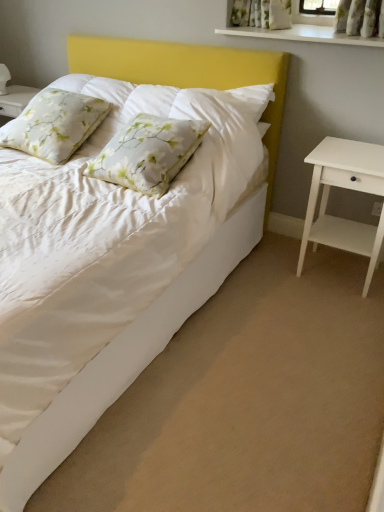
The image size is (384, 512). Describe the element at coordinates (345, 188) in the screenshot. I see `white matte nightstand at right` at that location.

You are a GUI agent. You are given a task and a screenshot of the screen. Output one action in this format:
    pyautogui.click(x=<x>, y=<y>)
    Task: Click on the white matte nightstand at right
    The height and width of the screenshot is (512, 384).
    Given the screenshot: What is the action you would take?
    pyautogui.click(x=345, y=188)

Does white satin bed at lower left have a lesser width compared to floral fabric pillow at upper left, placed as the 2th pillow when sorted from right to left?

Incorrect, the width of white satin bed at lower left is not less than that of floral fabric pillow at upper left, placed as the 2th pillow when sorted from right to left.

Between white satin bed at lower left and floral fabric pillow at upper left, placed as the 2th pillow when sorted from right to left, which one has larger size?

With larger size is white satin bed at lower left.

Between point (234, 254) and point (25, 117), which one is positioned behind?

Positioned behind is point (234, 254).

Considering the relative sizes of white satin bed at lower left and floral fabric pillow at upper left, placed as the 2th pillow when sorted from right to left, in the image provided, is white satin bed at lower left taller than floral fabric pillow at upper left, placed as the 2th pillow when sorted from right to left,?

No, white satin bed at lower left is not taller than floral fabric pillow at upper left, placed as the 2th pillow when sorted from right to left.

In the scene shown: Considering the sizes of objects floral fabric pillow at upper left, placed as the 2th pillow when sorted from right to left, and white glossy shelf at upper center in the image provided, who is bigger, floral fabric pillow at upper left, placed as the 2th pillow when sorted from right to left, or white glossy shelf at upper center?

floral fabric pillow at upper left, placed as the 2th pillow when sorted from right to left, is bigger.

Considering the sizes of objects floral fabric pillow at upper left, placed as the 2th pillow when sorted from right to left, and white glossy shelf at upper center in the image provided, who is thinner, floral fabric pillow at upper left, placed as the 2th pillow when sorted from right to left, or white glossy shelf at upper center?

white glossy shelf at upper center.

In the scene shown: Is floral fabric pillow at upper left, the 1th pillow in the left-to-right sequence, situated inside white glossy shelf at upper center or outside?

Result: The correct answer is: outside.

Is floral fabric pillow at upper left, placed as the 2th pillow when sorted from right to left, facing towards white glossy shelf at upper center?

No, floral fabric pillow at upper left, placed as the 2th pillow when sorted from right to left, is not oriented towards white glossy shelf at upper center.

Does white glossy shelf at upper center have a lesser width compared to floral fabric pillow at upper left, placed as the 2th pillow when sorted from right to left?

Correct, the width of white glossy shelf at upper center is less than that of floral fabric pillow at upper left, placed as the 2th pillow when sorted from right to left.

Does white glossy shelf at upper center have a larger size compared to floral fabric pillow at upper left, placed as the 2th pillow when sorted from right to left?

Actually, white glossy shelf at upper center might be smaller than floral fabric pillow at upper left, placed as the 2th pillow when sorted from right to left.

Is white glossy shelf at upper center completely or partially outside of floral fabric pillow at upper left, the 1th pillow in the left-to-right sequence?

Indeed, white glossy shelf at upper center is completely outside floral fabric pillow at upper left, the 1th pillow in the left-to-right sequence.

How different are the orientations of white glossy shelf at upper center and floral fabric pillow at upper left, the 1th pillow in the left-to-right sequence, in degrees?

The angular difference between white glossy shelf at upper center and floral fabric pillow at upper left, the 1th pillow in the left-to-right sequence, is 3.9 degrees.

Where is `nightstand below the white glossy shelf at upper center (from the image's perspective)`? nightstand below the white glossy shelf at upper center (from the image's perspective) is located at coordinates (345, 188).

From the image's perspective, is white glossy shelf at upper center on white matte nightstand at right?

Indeed, from the image's perspective, white glossy shelf at upper center is shown above white matte nightstand at right.

Which of these two, white glossy shelf at upper center or white matte nightstand at right, stands taller?

Standing taller between the two is white matte nightstand at right.

Considering their positions, is white glossy shelf at upper center located in front of or behind white matte nightstand at right?

white glossy shelf at upper center is behind white matte nightstand at right.

From a real-world perspective, is floral fabric pillow at upper left, placed as the 2th pillow when sorted from right to left, below white floral pillow at center, positioned as the second pillow in left-to-right order?

No, from a real-world perspective, floral fabric pillow at upper left, placed as the 2th pillow when sorted from right to left, is not under white floral pillow at center, positioned as the second pillow in left-to-right order.

Is floral fabric pillow at upper left, the 1th pillow in the left-to-right sequence, bigger than white floral pillow at center, positioned as the second pillow in left-to-right order?

Yes.

Where is `pillow below the floral fabric pillow at upper left, placed as the 2th pillow when sorted from right to left (from the image's perspective)`? The image size is (384, 512). pillow below the floral fabric pillow at upper left, placed as the 2th pillow when sorted from right to left (from the image's perspective) is located at coordinates (148, 153).

Is floral fabric pillow at upper left, the 1th pillow in the left-to-right sequence, taller or shorter than white floral pillow at center, placed as the 1th pillow when sorted from right to left?

floral fabric pillow at upper left, the 1th pillow in the left-to-right sequence, is taller than white floral pillow at center, placed as the 1th pillow when sorted from right to left.

Considering the sizes of objects white matte nightstand at right and white satin bed at lower left in the image provided, who is thinner, white matte nightstand at right or white satin bed at lower left?

white matte nightstand at right is thinner.

Which point is more forward, [369,170] or [105,45]?

The point [369,170] is closer.

Considering the sizes of objects white matte nightstand at right and white satin bed at lower left in the image provided, who is smaller, white matte nightstand at right or white satin bed at lower left?

white matte nightstand at right.

Where is `nightstand behind the white satin bed at lower left`? nightstand behind the white satin bed at lower left is located at coordinates (345, 188).

Locate an element on the screen. Image resolution: width=384 pixels, height=512 pixels. nightstand below the white floral pillow at center, positioned as the second pillow in left-to-right order (from the image's perspective) is located at coordinates (345, 188).

From a real-world perspective, is white floral pillow at center, positioned as the second pillow in left-to-right order, physically below white matte nightstand at right?

Incorrect, from a real-world perspective, white floral pillow at center, positioned as the second pillow in left-to-right order, is higher than white matte nightstand at right.

In the scene shown: Which is more distant, (204,131) or (338,160)?

The point (204,131) is behind.

Is white floral pillow at center, placed as the 1th pillow when sorted from right to left, at the left side of white matte nightstand at right?

Indeed, white floral pillow at center, placed as the 1th pillow when sorted from right to left, is positioned on the left side of white matte nightstand at right.

Find the location of `bed located underneath the floral fabric pillow at upper left, the 1th pillow in the left-to-right sequence (from a real-world perspective)`. bed located underneath the floral fabric pillow at upper left, the 1th pillow in the left-to-right sequence (from a real-world perspective) is located at coordinates (180, 274).

From the white glossy shelf at upper center, count the 2nd pillow to the left and point to it. Please provide its 2D coordinates.

[(55, 124)]

Based on their spatial positions, is white matte nightstand at right or white glossy shelf at upper center further from floral fabric pillow at upper left, placed as the 2th pillow when sorted from right to left?

The object further to floral fabric pillow at upper left, placed as the 2th pillow when sorted from right to left, is white matte nightstand at right.

Considering their positions, is white satin bed at lower left positioned closer to white glossy shelf at upper center than white floral pillow at center, placed as the 1th pillow when sorted from right to left?

white floral pillow at center, placed as the 1th pillow when sorted from right to left, is positioned closer to the anchor white glossy shelf at upper center.

When comparing their distances from floral fabric pillow at upper left, the 1th pillow in the left-to-right sequence, does white glossy shelf at upper center or white floral pillow at center, positioned as the second pillow in left-to-right order, seem closer?

The object closer to floral fabric pillow at upper left, the 1th pillow in the left-to-right sequence, is white floral pillow at center, positioned as the second pillow in left-to-right order.

Based on their spatial positions, is white floral pillow at center, placed as the 1th pillow when sorted from right to left, or white matte nightstand at right further from white glossy shelf at upper center?

Based on the image, white floral pillow at center, placed as the 1th pillow when sorted from right to left, appears to be further to white glossy shelf at upper center.

Based on the photo, which object lies nearer to the anchor point white glossy shelf at upper center, white floral pillow at center, positioned as the second pillow in left-to-right order, or floral fabric pillow at upper left, the 1th pillow in the left-to-right sequence?

Based on the image, white floral pillow at center, positioned as the second pillow in left-to-right order, appears to be nearer to white glossy shelf at upper center.

Estimate the real-world distances between objects in this image. Which object is further from white floral pillow at center, positioned as the second pillow in left-to-right order, white glossy shelf at upper center or floral fabric pillow at upper left, the 1th pillow in the left-to-right sequence?

Among the two, white glossy shelf at upper center is located further to white floral pillow at center, positioned as the second pillow in left-to-right order.

Looking at the image, which one is located closer to floral fabric pillow at upper left, placed as the 2th pillow when sorted from right to left, white satin bed at lower left or white matte nightstand at right?

white satin bed at lower left is positioned closer to the anchor floral fabric pillow at upper left, placed as the 2th pillow when sorted from right to left.

From the image, which object appears to be farther from white floral pillow at center, placed as the 1th pillow when sorted from right to left, white glossy shelf at upper center or white matte nightstand at right?

white glossy shelf at upper center is further to white floral pillow at center, placed as the 1th pillow when sorted from right to left.

At what (x,y) coordinates should I click in order to perform the action: click on window sill between white floral pillow at center, positioned as the second pillow in left-to-right order, and white matte nightstand at right. Please return your answer as a coordinate pair (x, y). This screenshot has height=512, width=384. Looking at the image, I should click on (303, 35).

Identify the location of window sill between floral fabric pillow at upper left, the 1th pillow in the left-to-right sequence, and white matte nightstand at right. This screenshot has height=512, width=384. (303, 35).

At what (x,y) coordinates should I click in order to perform the action: click on pillow between floral fabric pillow at upper left, placed as the 2th pillow when sorted from right to left, and white satin bed at lower left in the up-down direction. Please return your answer as a coordinate pair (x, y). Looking at the image, I should click on (148, 153).

I want to click on bed situated between white floral pillow at center, positioned as the second pillow in left-to-right order, and white matte nightstand at right from left to right, so click(x=180, y=274).